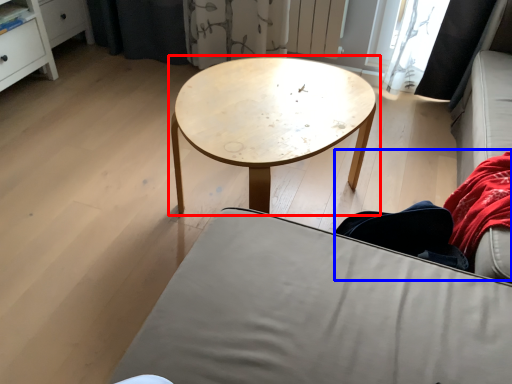
Question: Which point is closer to the camera, coffee table (highlighted by a red box) or couple (highlighted by a blue box)?

Choices:
 (A) coffee table
 (B) couple

Answer: (B)